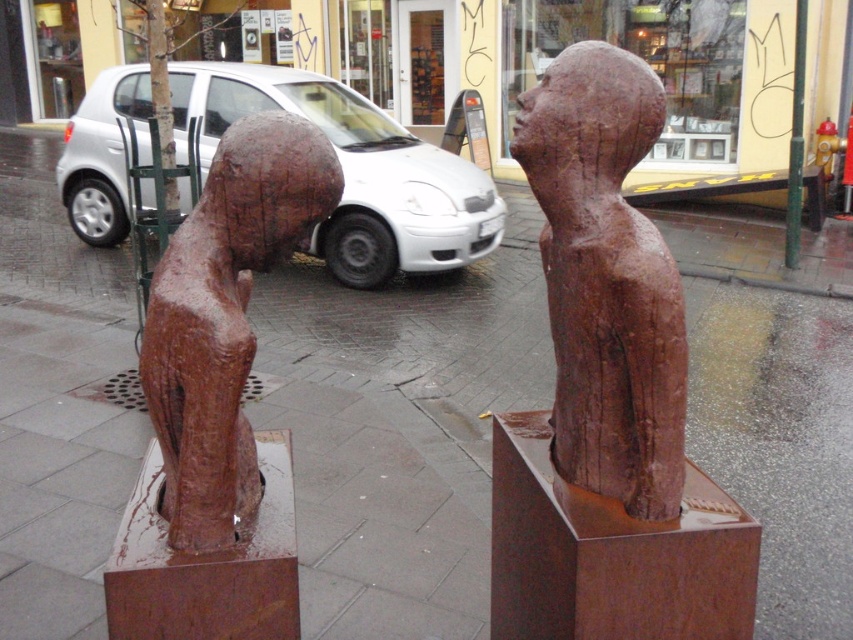
You are a delivery person who needs to place a small package exactly at the point marked by the coordinates point (606, 280). Given the urban street scene described, where should you place the package?

The point marked by the coordinates point (606, 280) corresponds to the rusty wood statue at center. You should place the package at the base of the rusty wood statue at center.

You are an art curator planning to move the rusty wood statue at center and the rusty bronze statue at left to a new gallery. The entrance has a doorway that is 1.5 meters wide. Can both statues pass through the doorway if placed side by side?

The rusty wood statue at center is larger in size than the rusty bronze statue at left. Since the doorway is 1.5 meters wide, it depends on the combined width of both statues. However, without specific measurements, it is impossible to determine if they can fit side by side.

You are a delivery person trying to park your silver metallic car at center in a tight space. The rusty wood statue at center is in the way. Can you fit your car without hitting the statue?

The rusty wood statue at center is smaller than the silver metallic car at center, so there is enough space to park the silver metallic car at center without hitting the statue.